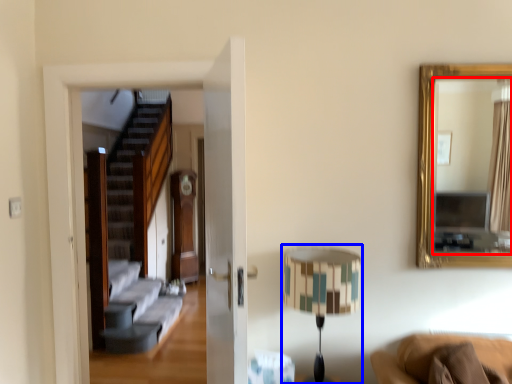
Question: Which object is closer to the camera taking this photo, mirror (highlighted by a red box) or table lamp (highlighted by a blue box)?

Choices:
 (A) mirror
 (B) table lamp

Answer: (B)